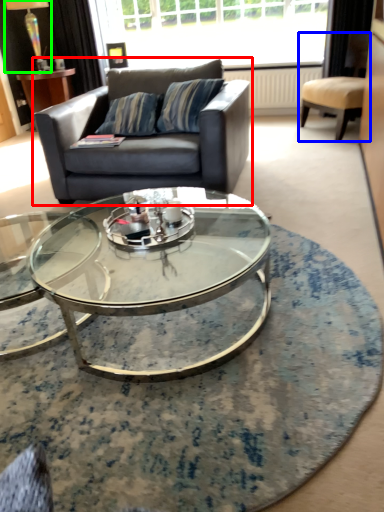
Question: Estimate the real-world distances between objects in this image. Which object is closer to studio couch (highlighted by a red box), chair (highlighted by a blue box) or lamp (highlighted by a green box)?

Choices:
 (A) chair
 (B) lamp

Answer: (A)